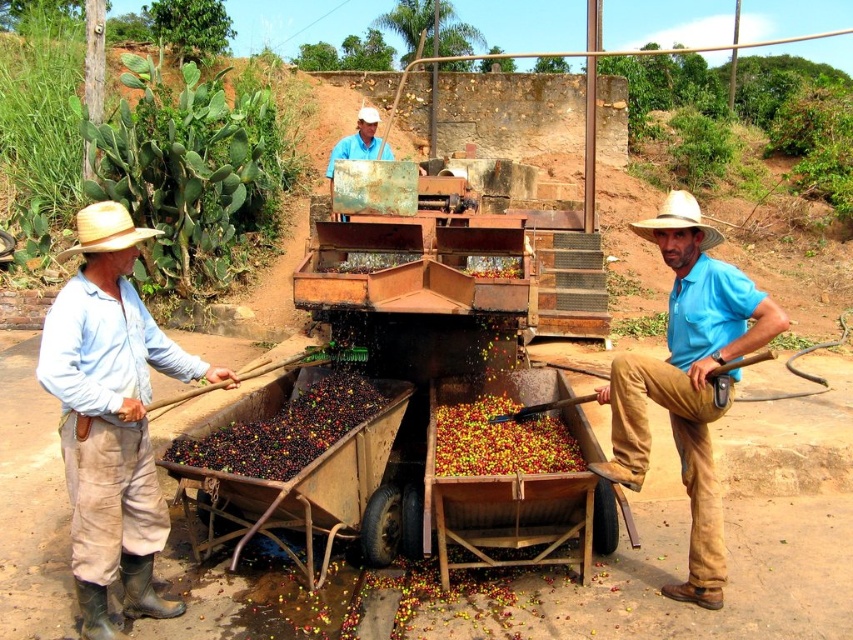
You are standing in the middle of the coffee processing area and notice the shiny red coffee beans at center and the light blue shirt at center. Which object is positioned to the right of the other?

The shiny red coffee beans at center is to the right of the light blue shirt at center.

You are a farmer working in the coffee plantation. You need to move the shiny red coffee beans at center to a storage area. Which direction should you move the brown wooden cart at center to access the beans?

The brown wooden cart at center is below the shiny red coffee beans at center, so you should move the brown wooden cart at center upwards to access the beans.

Based on the coordinates provided, where is the light blue cotton shirt at left positioned in the image?

The light blue cotton shirt at left is positioned at the coordinates point (x=111, y=417) in the image.